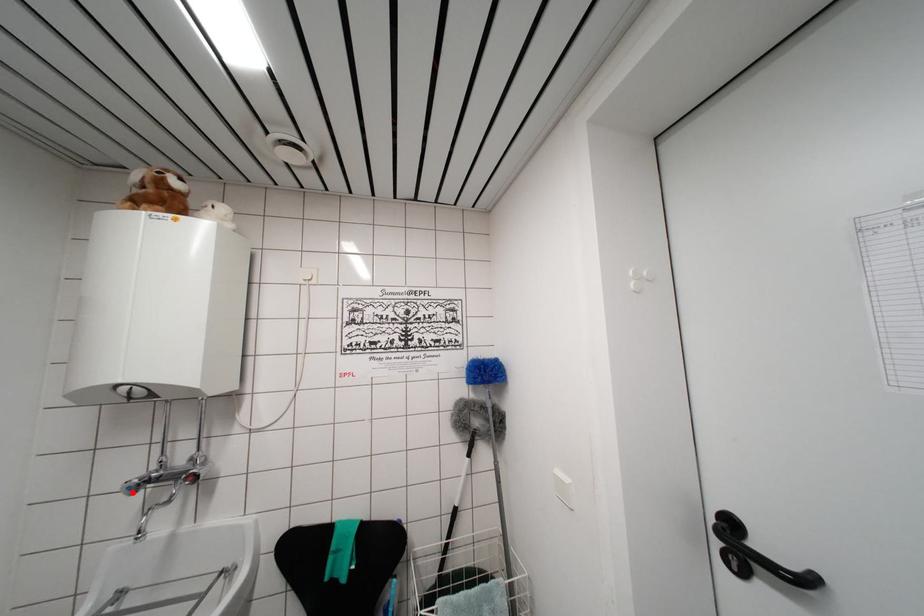
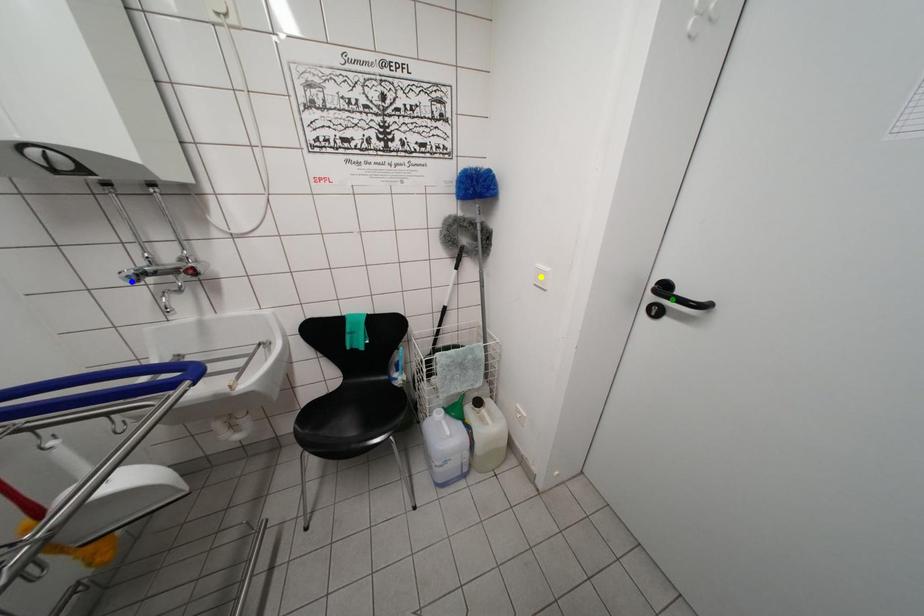
Question: I am providing you with two images of the same scene from different viewpoints. A red point is marked on the first image. You are given multiple points on the second image. In image 2, which mark is for the same physical point as the one in image 1?

Choices:
 (A) yellow point
 (B) green point
 (C) blue point

Answer: (C)